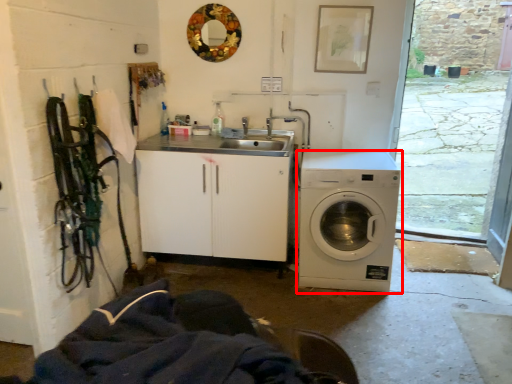
Question: From the image's perspective, what is the correct spatial positioning of washing machine (annotated by the red box) in reference to mirror?

Choices:
 (A) above
 (B) below

Answer: (B)